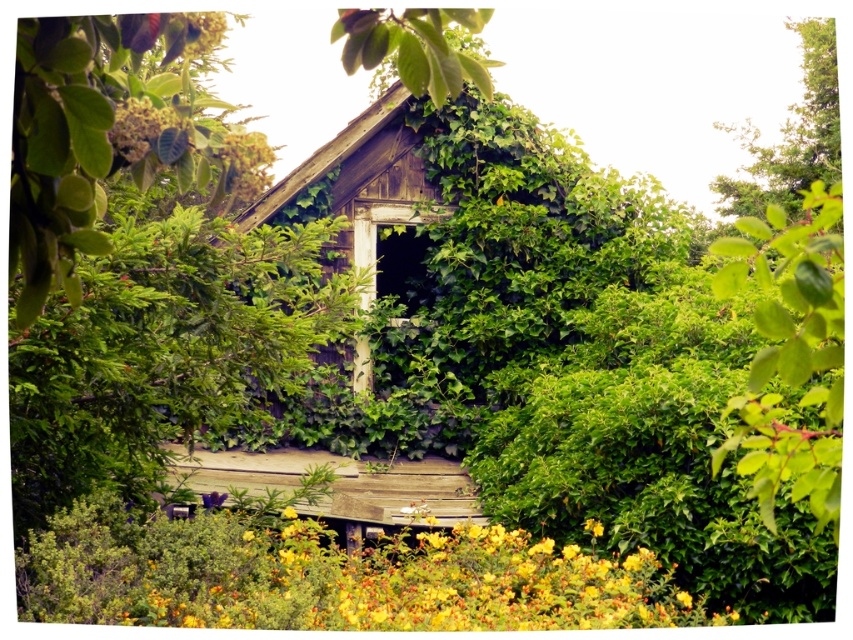
Question: Is green matte flower at upper center to the left of yellow textured flower at upper left from the viewer's perspective?

Choices:
 (A) no
 (B) yes

Answer: (B)

Question: Among these objects, which one is farthest from the camera?

Choices:
 (A) yellow matte flower at lower center
 (B) wooden hut at center
 (C) yellow textured flower at upper left
 (D) green matte leaf at upper left

Answer: (B)

Question: Estimate the real-world distances between objects in this image. Which object is closer to the green matte leaf at upper left?

Choices:
 (A) yellow textured flower at upper left
 (B) green matte flower at upper center

Answer: (B)

Question: Estimate the real-world distances between objects in this image. Which object is farther from the green matte leaf at upper left?

Choices:
 (A) yellow matte flower at lower center
 (B) wooden hut at center

Answer: (B)

Question: Is wooden hut at center bigger than green matte flower at upper center?

Choices:
 (A) no
 (B) yes

Answer: (A)

Question: Is wooden hut at center below yellow textured flower at upper left?

Choices:
 (A) yes
 (B) no

Answer: (A)